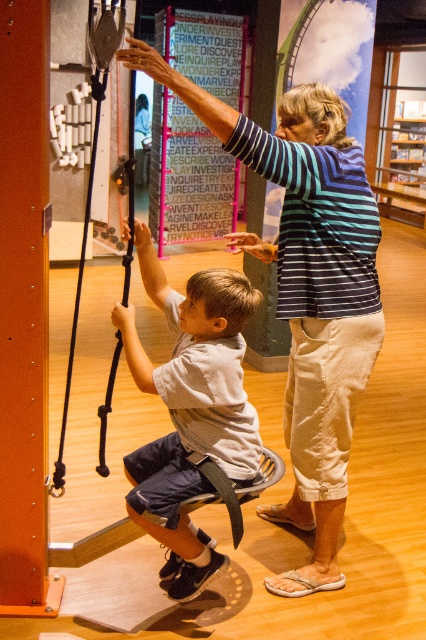
Question: Does gray fabric shirt at center have a greater width compared to black rubber swing at left?

Choices:
 (A) no
 (B) yes

Answer: (A)

Question: Which point is closer to the camera taking this photo?

Choices:
 (A) (131, 317)
 (B) (71, 330)

Answer: (A)

Question: Which point is farther from the camera taking this photo?

Choices:
 (A) (83, 262)
 (B) (184, 452)

Answer: (B)

Question: Is gray fabric shirt at center to the left of black rubber swing at left from the viewer's perspective?

Choices:
 (A) no
 (B) yes

Answer: (A)

Question: Which of the following is the closest to the observer?

Choices:
 (A) gray fabric shirt at center
 (B) black rubber swing at left

Answer: (B)

Question: Is gray fabric shirt at center to the right of black rubber swing at left from the viewer's perspective?

Choices:
 (A) yes
 (B) no

Answer: (A)